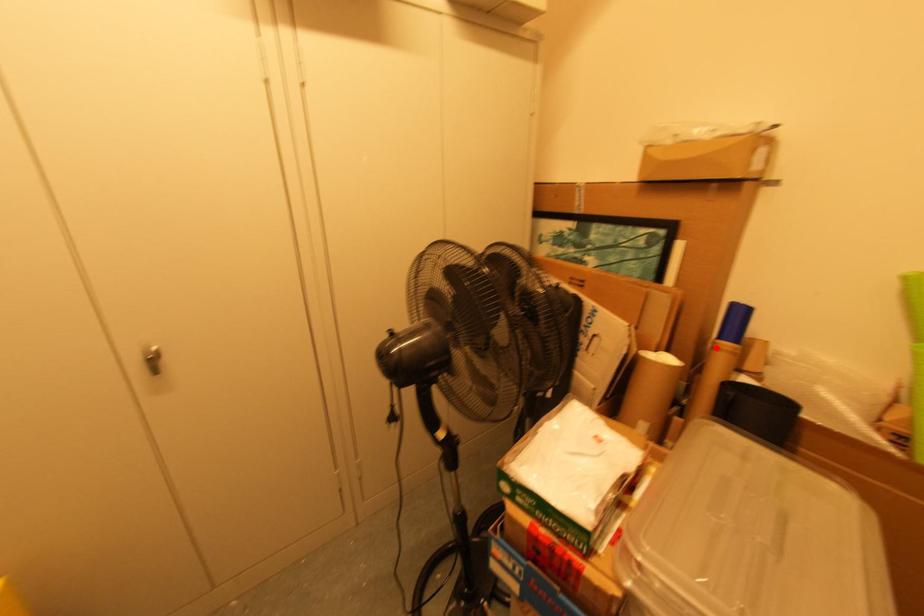
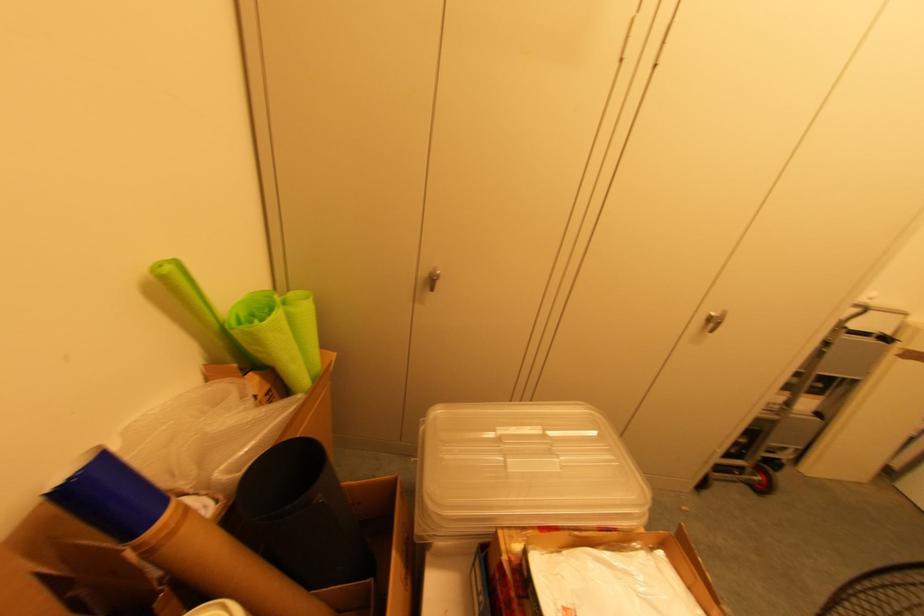
Where in the second image is the point corresponding to the highlighted location from the first image?

(152, 551)